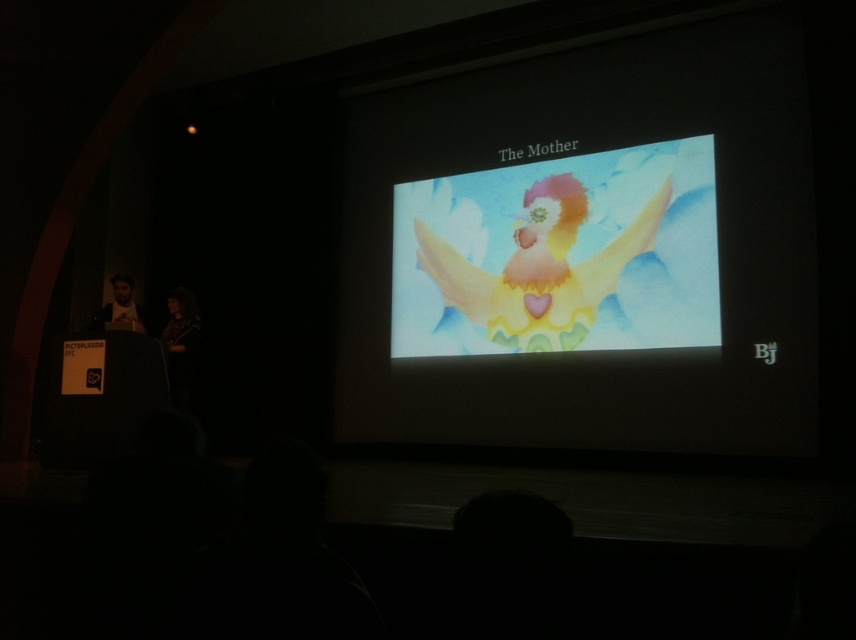
You are an architect designing a new exhibition space. You need to place a spotlight exactly at the coordinates where the pastel watercolor angel at center is located. What are the coordinates you should program the spotlight to aim at?

The pastel watercolor angel at center is positioned at coordinates point (559, 256), so the spotlight should be programmed to aim at point (559, 256).

You are an event organizer who needs to ensure that all items on the stage are visible to the audience. The pastel watercolor angel at center and the matte black jacket at lower left are both on the stage. Considering their sizes, which item might be more easily seen by the audience?

The pastel watercolor angel at center has a greater height compared to the matte black jacket at lower left, so it would be more easily seen by the audience.

Based on the photo, you are an attendee at the presentation and want to take a photo of the pastel watercolor angel at center and the matte black jacket at lower left. Which object should you focus on first to ensure both are in clear view?

You should focus on the pastel watercolor angel at center first because it is closer to the viewer than the matte black jacket at lower left, so adjusting focus from near to far will help both objects be in clear view.